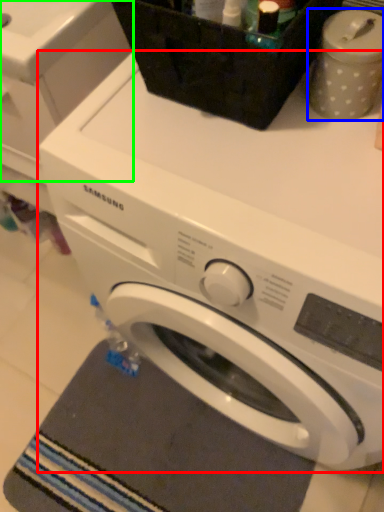
Question: Estimate the real-world distances between objects in this image. Which object is farther from washing machine (highlighted by a red box), appliance (highlighted by a blue box) or washing machine (highlighted by a green box)?

Choices:
 (A) appliance
 (B) washing machine

Answer: (B)